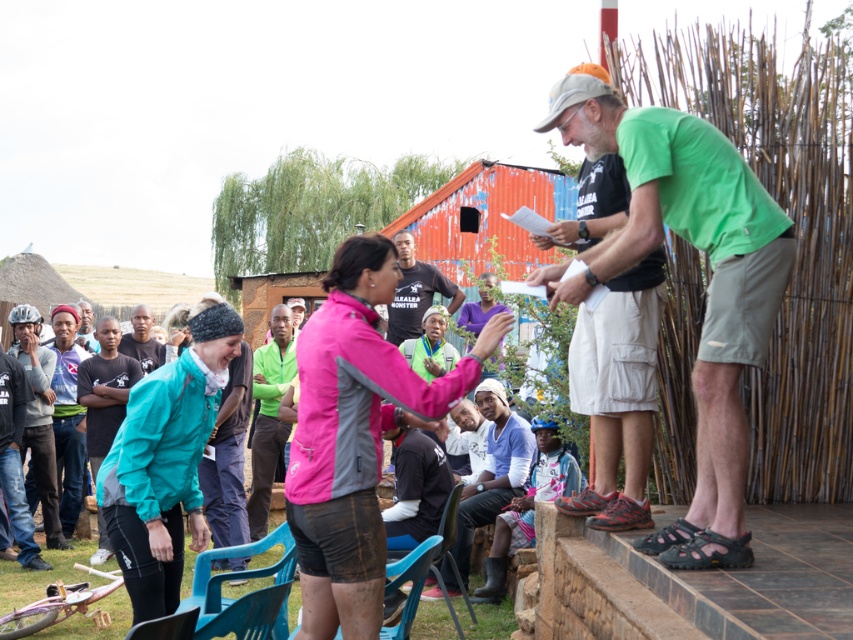
You are standing at the origin point of the coordinate system. You want to walk towards the blue cotton shirt at center. What direction should you walk?

The blue cotton shirt at center is located at coordinate point 0.733 in the x axis and 0.579 in the y axis. Since you are at the origin point, you should walk towards the positive x and positive y direction to reach the blue cotton shirt at center.

You are standing at the center of the image and want to locate the blue cotton shirt at center. Which direction should you look to find it?

The blue cotton shirt at center is located at point coordinates 0.733 on the x axis and 0.579 on the y axis, so you should look towards the right and slightly downward from the center to find it.